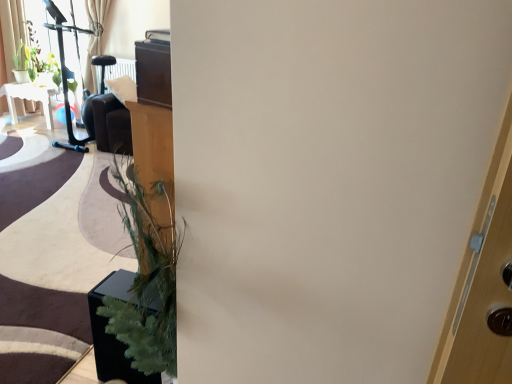
Question: Is the position of light beige fabric curtain at upper left more distant than that of white glossy table at upper left?

Choices:
 (A) yes
 (B) no

Answer: (B)

Question: From a real-world perspective, is light beige fabric curtain at upper left positioned under white glossy table at upper left based on gravity?

Choices:
 (A) no
 (B) yes

Answer: (A)

Question: Is light beige fabric curtain at upper left facing away from white glossy table at upper left?

Choices:
 (A) no
 (B) yes

Answer: (A)

Question: Considering the relative sizes of light beige fabric curtain at upper left and white glossy table at upper left in the image provided, is light beige fabric curtain at upper left smaller than white glossy table at upper left?

Choices:
 (A) yes
 (B) no

Answer: (A)

Question: Considering the relative sizes of light beige fabric curtain at upper left and white glossy table at upper left in the image provided, is light beige fabric curtain at upper left taller than white glossy table at upper left?

Choices:
 (A) no
 (B) yes

Answer: (B)

Question: Is white glossy table at upper left wider or thinner than green matte plant at upper left, the first plant viewed from the left?

Choices:
 (A) wide
 (B) thin

Answer: (A)

Question: Is point (8, 99) closer or farther from the camera than point (19, 66)?

Choices:
 (A) closer
 (B) farther

Answer: (A)

Question: In terms of height, does white glossy table at upper left look taller or shorter compared to green matte plant at upper left, the second plant positioned from the right?

Choices:
 (A) tall
 (B) short

Answer: (A)

Question: From a real-world perspective, is white glossy table at upper left physically located above or below green matte plant at upper left, the second plant positioned from the right?

Choices:
 (A) above
 (B) below

Answer: (B)

Question: Considering the positions of green matte plant at upper left, the second plant positioned from the right, and white glossy table at upper left in the image, is green matte plant at upper left, the second plant positioned from the right, wider or thinner than white glossy table at upper left?

Choices:
 (A) wide
 (B) thin

Answer: (B)

Question: From a real-world perspective, is green matte plant at upper left, the first plant viewed from the left, above or below white glossy table at upper left?

Choices:
 (A) below
 (B) above

Answer: (B)

Question: Is green matte plant at upper left, the second plant positioned from the right, in front of or behind white glossy table at upper left in the image?

Choices:
 (A) behind
 (B) front

Answer: (A)

Question: Which is correct: green matte plant at upper left, the first plant viewed from the left, is inside white glossy table at upper left, or outside of it?

Choices:
 (A) outside
 (B) inside

Answer: (A)

Question: Considering the relative positions of green matte plant at upper left, marked as the second plant in a left-to-right arrangement, and white glossy table at upper left in the image provided, is green matte plant at upper left, marked as the second plant in a left-to-right arrangement, to the left or to the right of white glossy table at upper left?

Choices:
 (A) right
 (B) left

Answer: (A)

Question: Is green matte plant at upper left, marked as the second plant in a left-to-right arrangement, taller or shorter than white glossy table at upper left?

Choices:
 (A) short
 (B) tall

Answer: (B)